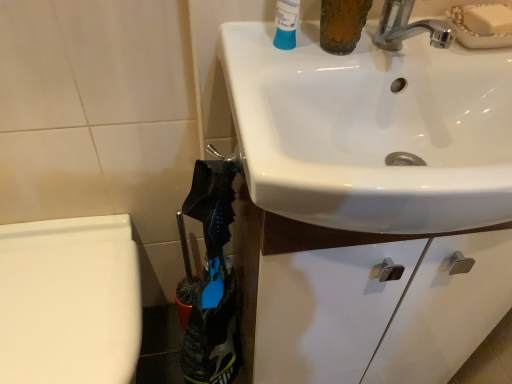
Question: From their relative heights in the image, would you say white glossy sink at upper right is taller or shorter than white glossy bidet at lower left?

Choices:
 (A) tall
 (B) short

Answer: (B)

Question: Looking at their shapes, would you say white glossy sink at upper right is wider or thinner than white glossy bidet at lower left?

Choices:
 (A) wide
 (B) thin

Answer: (A)

Question: Looking at the image, does white glossy sink at upper right seem bigger or smaller compared to white glossy bidet at lower left?

Choices:
 (A) small
 (B) big

Answer: (A)

Question: Considering the relative positions of white glossy bidet at lower left and white glossy sink at upper right in the image provided, is white glossy bidet at lower left to the left or to the right of white glossy sink at upper right?

Choices:
 (A) right
 (B) left

Answer: (B)

Question: Looking at the image, does white glossy bidet at lower left seem bigger or smaller compared to white glossy sink at upper right?

Choices:
 (A) small
 (B) big

Answer: (B)

Question: From the image's perspective, is white glossy bidet at lower left positioned above or below white glossy sink at upper right?

Choices:
 (A) below
 (B) above

Answer: (A)

Question: Is point (31, 223) positioned closer to the camera than point (485, 180)?

Choices:
 (A) closer
 (B) farther

Answer: (B)